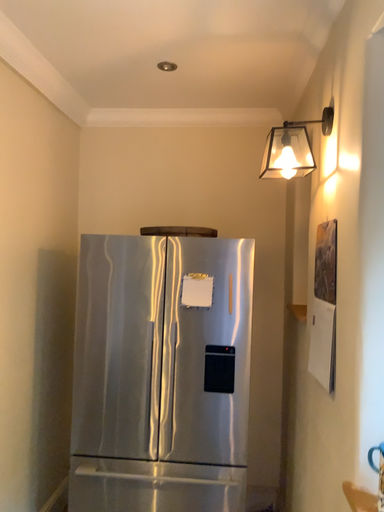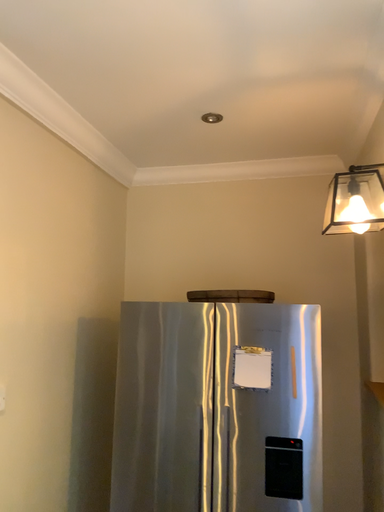
Question: How did the camera likely rotate when shooting the video?

Choices:
 (A) rotated upward
 (B) rotated downward

Answer: (A)